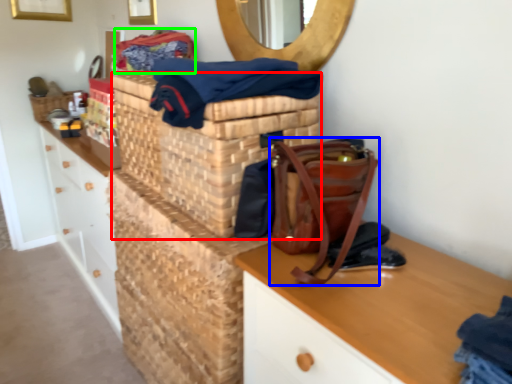
Question: Considering the real-world distances, which object is closest to basket container (highlighted by a red box)? handbag (highlighted by a blue box) or material (highlighted by a green box).

Choices:
 (A) handbag
 (B) material

Answer: (A)